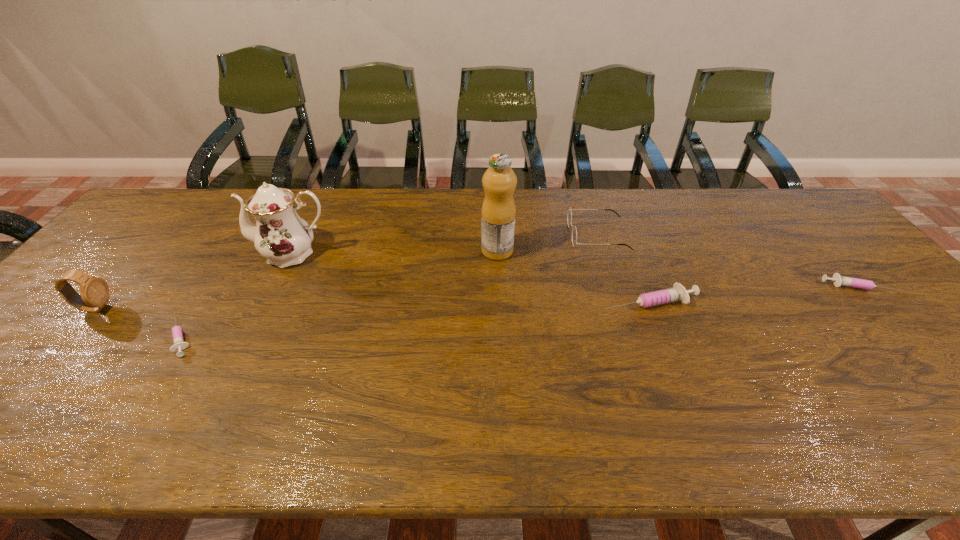
At what (x,y) coordinates should I click in order to perform the action: click on location for an additional syringe to make spacing equal. Please return your answer as a coordinate pair (x, y). Looking at the image, I should click on (423, 319).